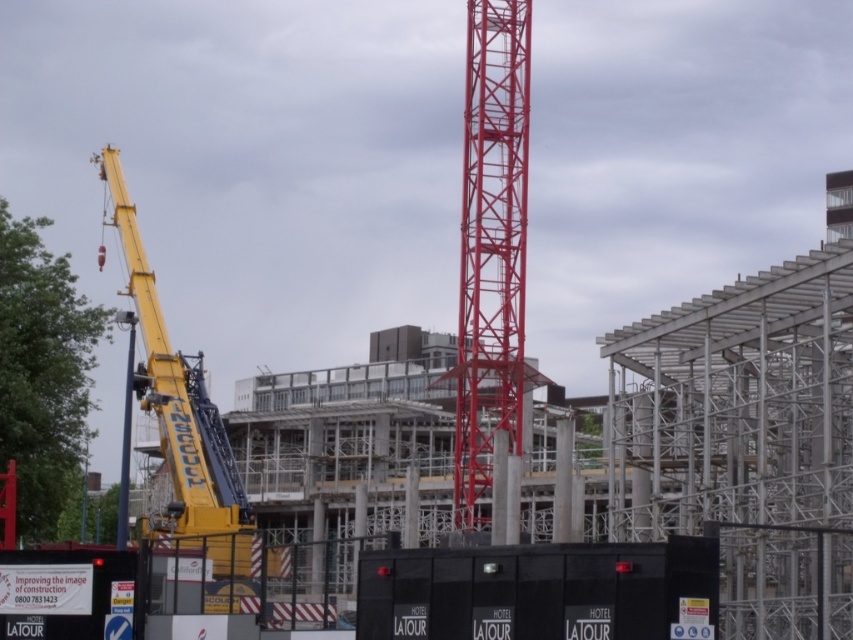
Does black rubber lift at lower center appear under blue painted metal pole at left?

Actually, black rubber lift at lower center is above blue painted metal pole at left.

Is point (381, 616) more distant than point (126, 416)?

No, it is in front of (126, 416).

Where is `black rubber lift at lower center`? Image resolution: width=853 pixels, height=640 pixels. black rubber lift at lower center is located at coordinates (541, 592).

Is metallic red crane at center further to camera compared to blue painted metal pole at left?

Yes, it is behind blue painted metal pole at left.

Between metallic red crane at center and blue painted metal pole at left, which one is positioned lower?

blue painted metal pole at left

Is point (491, 252) more distant than point (131, 333)?

Yes, point (491, 252) is farther from viewer.

Image resolution: width=853 pixels, height=640 pixels. Find the location of `metallic red crane at center`. metallic red crane at center is located at coordinates (491, 250).

Between black rubber lift at lower center and yellow metallic crane at left, which one is positioned higher?

Positioned higher is yellow metallic crane at left.

Based on the photo, can you confirm if black rubber lift at lower center is positioned to the left of yellow metallic crane at left?

Incorrect, black rubber lift at lower center is not on the left side of yellow metallic crane at left.

Who is more distant from viewer, [651,627] or [195,452]?

Point [195,452]

Locate an element on the screen. black rubber lift at lower center is located at coordinates point(541,592).